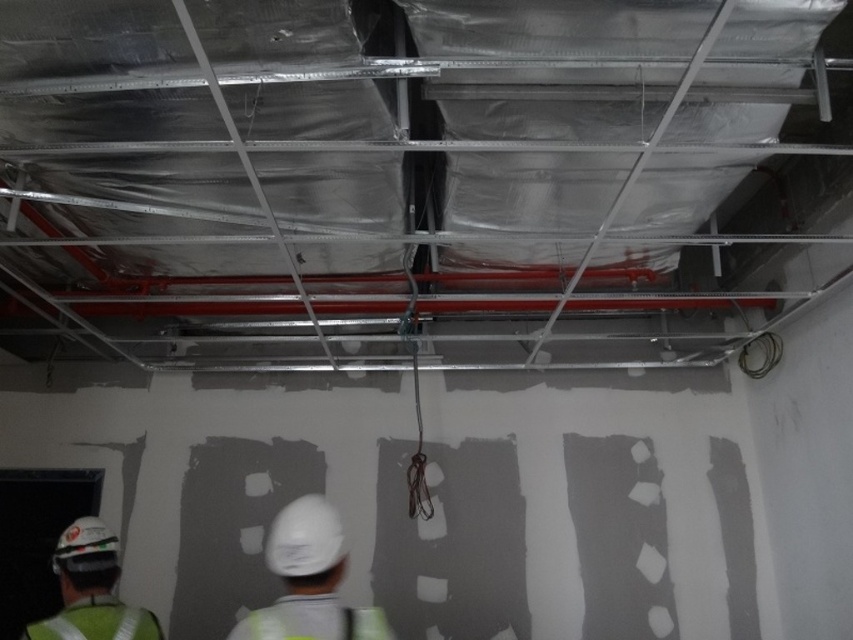
Is white hard hat at lower left taller than green reflective safety vest at lower left?

Yes.

Looking at this image, does white hard hat at lower left appear under green reflective safety vest at lower left?

Actually, white hard hat at lower left is above green reflective safety vest at lower left.

Between point (78, 598) and point (62, 625), which one is positioned in front?

Point (62, 625)

What are the coordinates of `white hard hat at lower left` in the screenshot? It's located at (91, 589).

Who is positioned more to the left, white matte hard hat at center or green reflective safety vest at lower left?

green reflective safety vest at lower left is more to the left.

Find the location of a particular element. Image resolution: width=853 pixels, height=640 pixels. white matte hard hat at center is located at coordinates (309, 580).

At what (x,y) coordinates should I click in order to perform the action: click on white matte hard hat at center. Please return your answer as a coordinate pair (x, y). This screenshot has width=853, height=640. Looking at the image, I should click on (309, 580).

Is white matte hard hat at center thinner than white hard hat at lower left?

Incorrect, white matte hard hat at center's width is not less than white hard hat at lower left's.

Can you confirm if white matte hard hat at center is positioned to the right of white hard hat at lower left?

Correct, you'll find white matte hard hat at center to the right of white hard hat at lower left.

Locate an element on the screen. white matte hard hat at center is located at coordinates (309, 580).